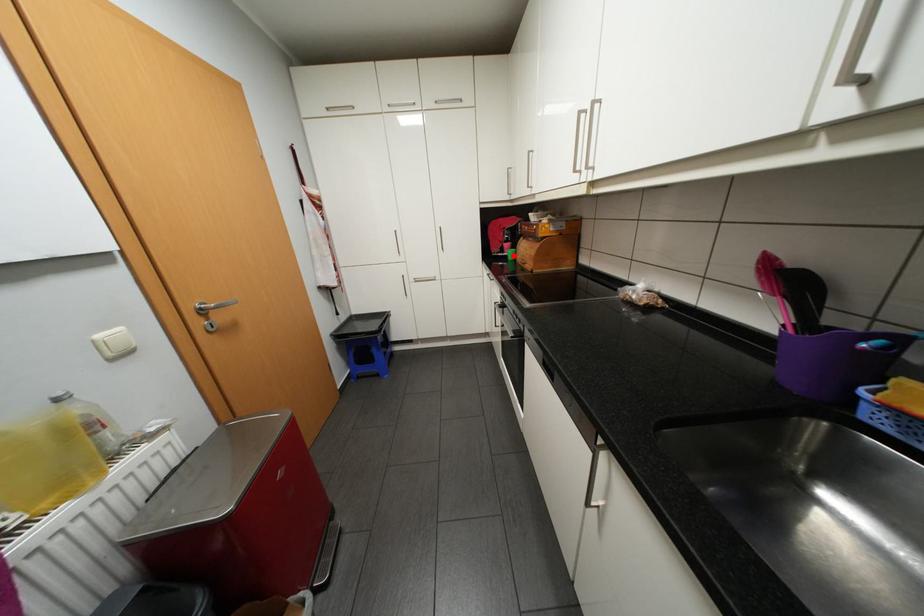
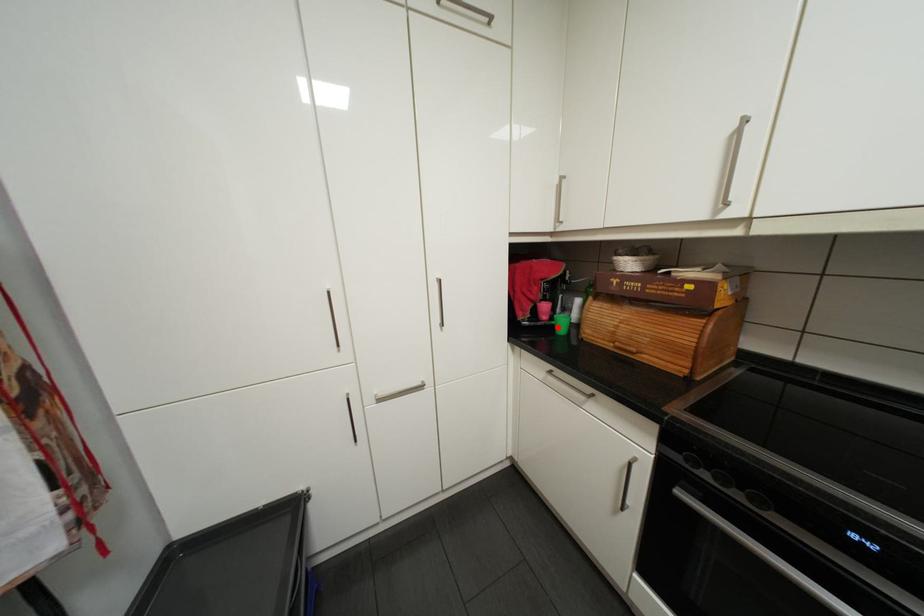
I am providing you with two images of the same scene from different viewpoints. A red point is marked on the first image and another point is marked on the second image. Do the highlighted points in image1 and image2 indicate the same real-world spot?

Yes